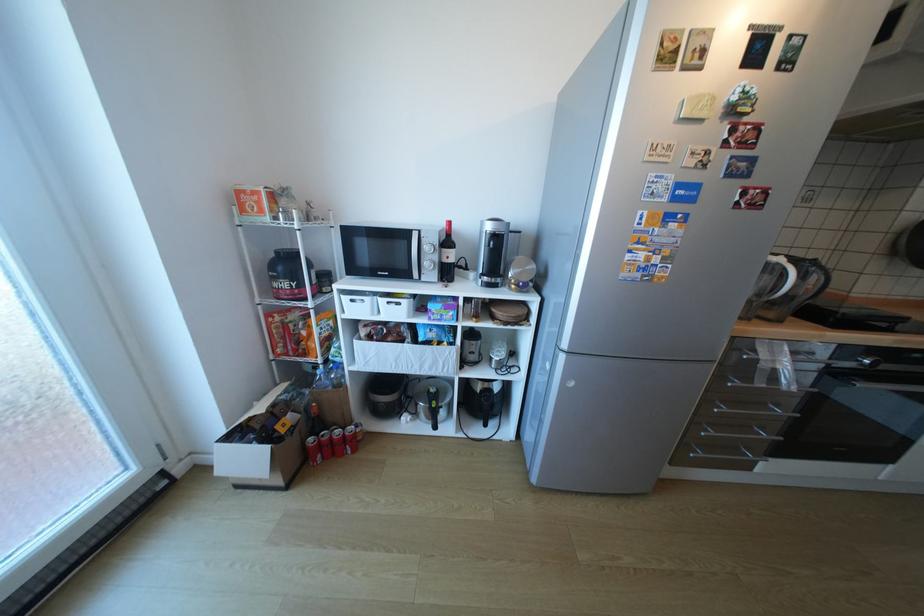
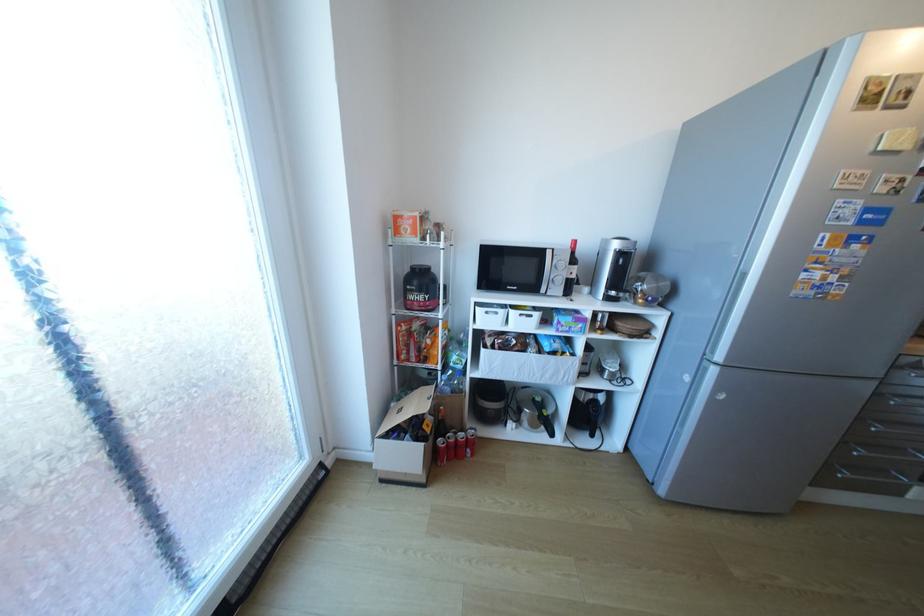
In the second image, find the point that corresponds to (x=361, y=301) in the first image.

(495, 313)